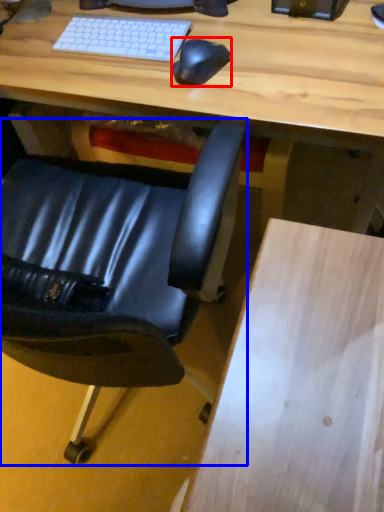
Question: Which of the following is the closest to the observer, mouse (highlighted by a red box) or chair (highlighted by a blue box)?

Choices:
 (A) mouse
 (B) chair

Answer: (B)